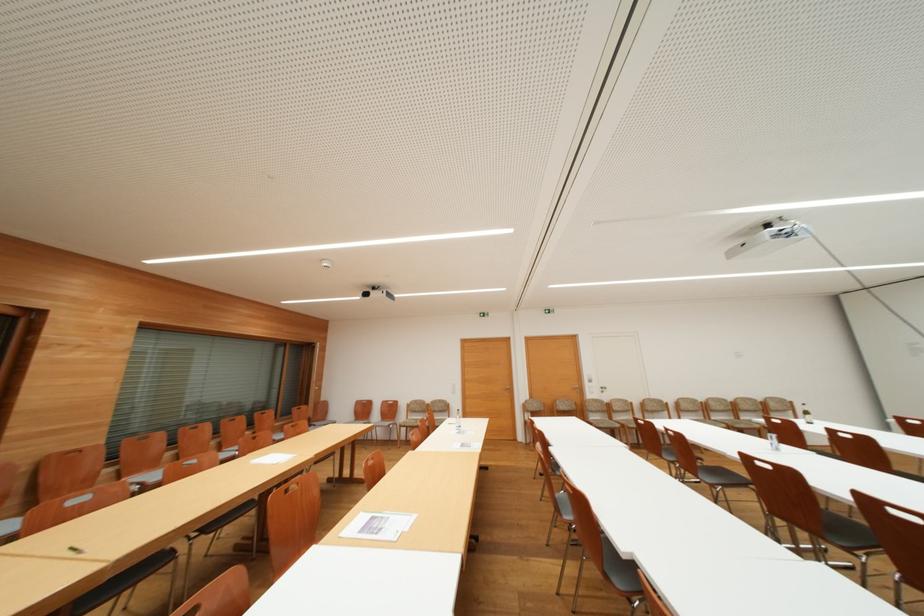
Where would you pull the white door handle? Please return your answer as a coordinate pair (x, y).

(603, 391)